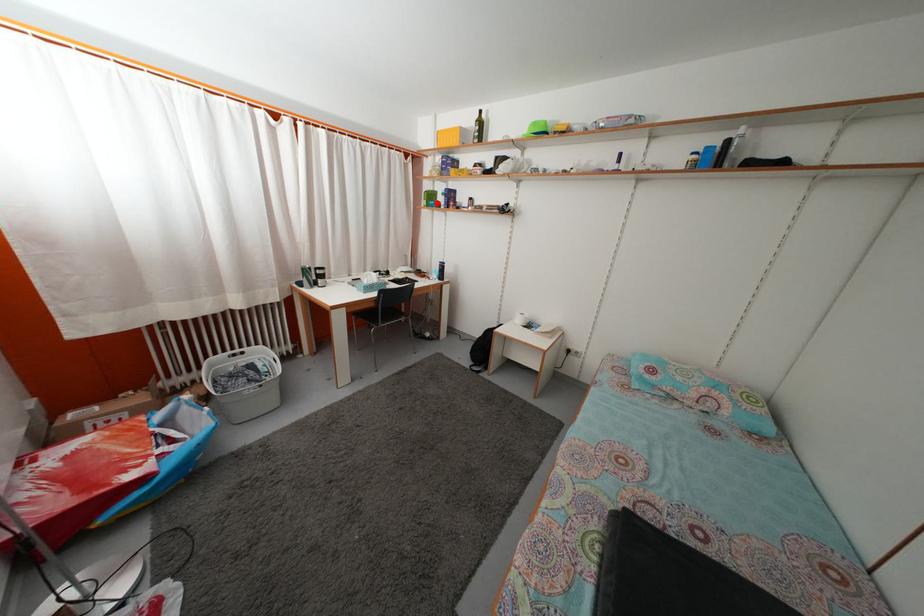
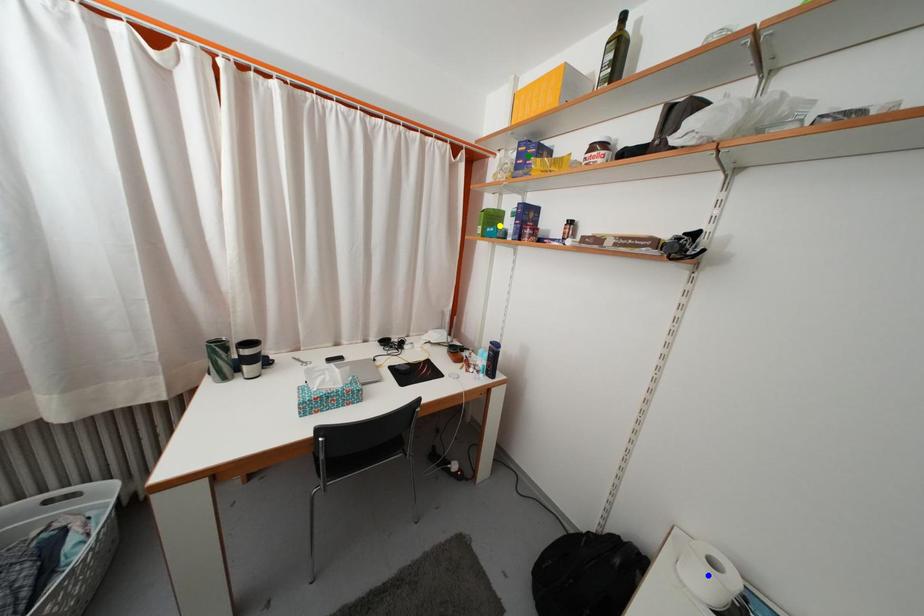
Question: I am providing you with two images of the same scene from different viewpoints. A red point is marked on the first image. You are given multiple points on the second image. Which point in image 2 is actually the same real-world point as the red point in image 1?

Choices:
 (A) blue point
 (B) green point
 (C) yellow point

Answer: (C)